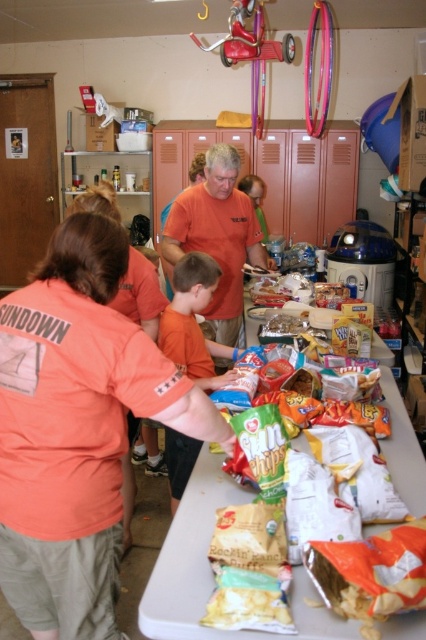
Question: Is white plastic table at center above orange cotton shirt at center?

Choices:
 (A) yes
 (B) no

Answer: (B)

Question: From the image, what is the correct spatial relationship of white plastic table at center in relation to orange cotton shirt at center?

Choices:
 (A) above
 (B) below

Answer: (B)

Question: Which point appears farthest from the camera in this image?

Choices:
 (A) (224, 326)
 (B) (399, 483)

Answer: (A)

Question: Among these objects, which one is farthest from the camera?

Choices:
 (A) orange cotton shirt at center
 (B) white plastic table at center

Answer: (A)

Question: Does white plastic table at center appear on the left side of orange cotton shirt at center?

Choices:
 (A) no
 (B) yes

Answer: (B)